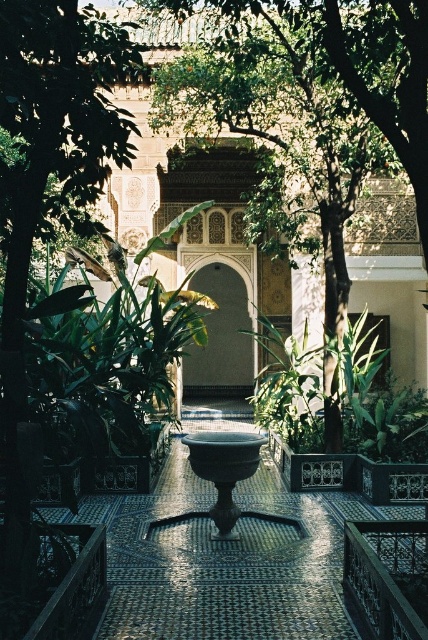
Question: Estimate the real-world distances between objects in this image. Which object is farther from the matte stone archway at center?

Choices:
 (A) shiny metal bowl at center
 (B) bronze bowl at center
 (C) green leafy tree at center

Answer: (B)

Question: Is green leafy tree at center in front of shiny metal bowl at center?

Choices:
 (A) no
 (B) yes

Answer: (A)

Question: Which point is farther to the camera?

Choices:
 (A) green leafy tree at center
 (B) bronze bowl at center
 (C) matte stone archway at center
 (D) shiny metal bowl at center

Answer: (C)

Question: Observing the image, what is the correct spatial positioning of shiny metal bowl at center in reference to matte stone archway at center?

Choices:
 (A) left
 (B) right

Answer: (B)

Question: Among these points, which one is nearest to the camera?

Choices:
 (A) (273, 212)
 (B) (253, 611)

Answer: (B)

Question: Can you confirm if shiny metal bowl at center is positioned above bronze bowl at center?

Choices:
 (A) yes
 (B) no

Answer: (B)